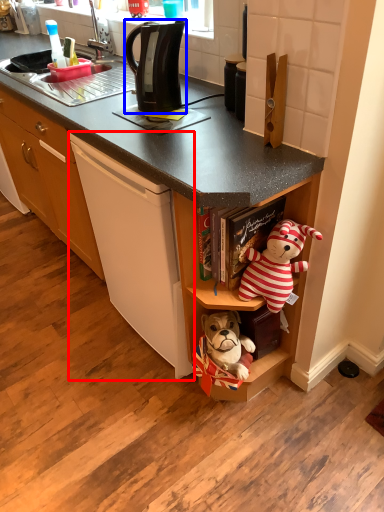
Question: Which object appears farthest to the camera in this image, cording machine (highlighted by a red box) or kitchen appliance (highlighted by a blue box)?

Choices:
 (A) cording machine
 (B) kitchen appliance

Answer: (B)